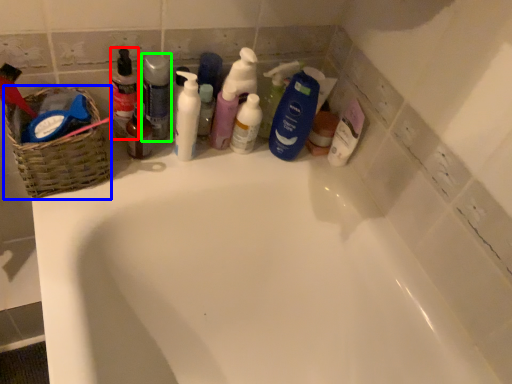
Question: Considering the real-world distances, which object is farthest from toiletry (highlighted by a red box)? basket (highlighted by a blue box) or cleaning product (highlighted by a green box)?

Choices:
 (A) basket
 (B) cleaning product

Answer: (A)